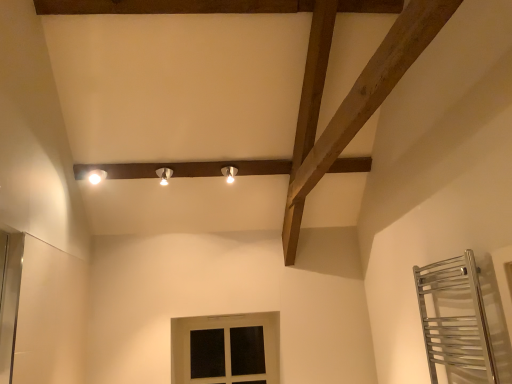
Question: Is matte black window at lower center oriented away from white glossy light fixture at upper center, the third light fixture viewed from the left?

Choices:
 (A) no
 (B) yes

Answer: (A)

Question: Is matte black window at lower center shorter than white glossy light fixture at upper center, placed as the 1th light fixture when sorted from right to left?

Choices:
 (A) no
 (B) yes

Answer: (A)

Question: Does matte black window at lower center have a greater width compared to white glossy light fixture at upper center, the third light fixture viewed from the left?

Choices:
 (A) yes
 (B) no

Answer: (B)

Question: Is matte black window at lower center in front of white glossy light fixture at upper center, the third light fixture viewed from the left?

Choices:
 (A) no
 (B) yes

Answer: (A)

Question: Would you say matte black window at lower center is outside white glossy light fixture at upper center, the third light fixture viewed from the left?

Choices:
 (A) yes
 (B) no

Answer: (A)

Question: Is matte black window at lower center to the right of white glossy light fixture at upper center, the third light fixture viewed from the left, from the viewer's perspective?

Choices:
 (A) no
 (B) yes

Answer: (A)

Question: Does white glossy light fixture at upper center, placed as the 1th light fixture when sorted from right to left, touch matte silver light fixture at center, the second light fixture positioned from the left?

Choices:
 (A) yes
 (B) no

Answer: (B)

Question: Does white glossy light fixture at upper center, the third light fixture viewed from the left, lie in front of matte silver light fixture at center, which is counted as the second light fixture, starting from the right?

Choices:
 (A) yes
 (B) no

Answer: (B)

Question: Are white glossy light fixture at upper center, the third light fixture viewed from the left, and matte silver light fixture at center, which is counted as the second light fixture, starting from the right, located far from each other?

Choices:
 (A) yes
 (B) no

Answer: (B)

Question: From a real-world perspective, is white glossy light fixture at upper center, the third light fixture viewed from the left, located beneath matte silver light fixture at center, which is counted as the second light fixture, starting from the right?

Choices:
 (A) no
 (B) yes

Answer: (B)

Question: Is white glossy light fixture at upper center, the third light fixture viewed from the left, wider than matte silver light fixture at center, which is counted as the second light fixture, starting from the right?

Choices:
 (A) yes
 (B) no

Answer: (B)

Question: Considering the relative sizes of white glossy light fixture at upper center, placed as the 1th light fixture when sorted from right to left, and matte silver light fixture at center, the second light fixture positioned from the left, in the image provided, is white glossy light fixture at upper center, placed as the 1th light fixture when sorted from right to left, smaller than matte silver light fixture at center, the second light fixture positioned from the left,?

Choices:
 (A) yes
 (B) no

Answer: (A)

Question: Can you confirm if matte black window at lower center is bigger than white glossy light fixture at upper left, the first light fixture when ordered from left to right?

Choices:
 (A) yes
 (B) no

Answer: (A)